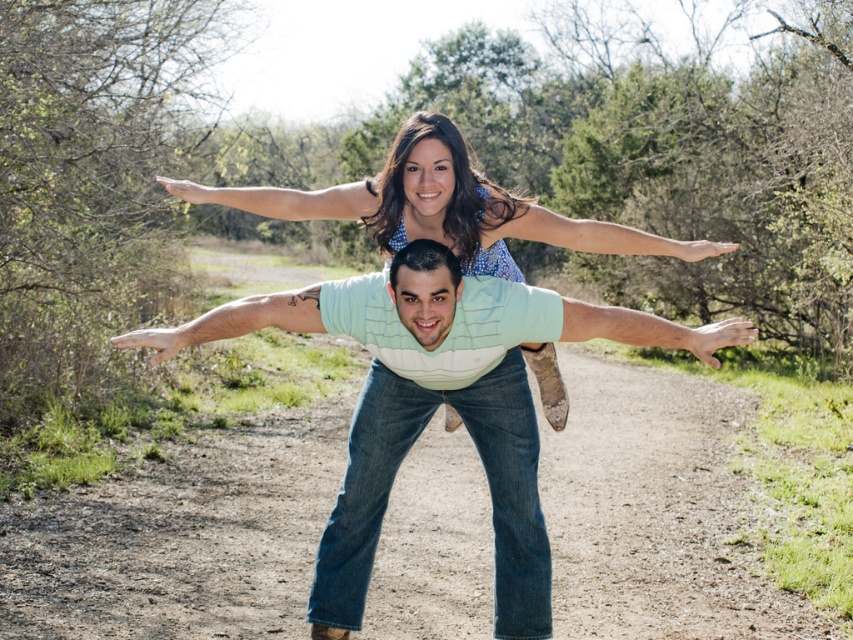
You are standing on the brown dirt track at center and looking towards the light blue denim jeans at center. Which object is closer to you?

The brown dirt track at center is closer to you because the light blue denim jeans at center is behind it.